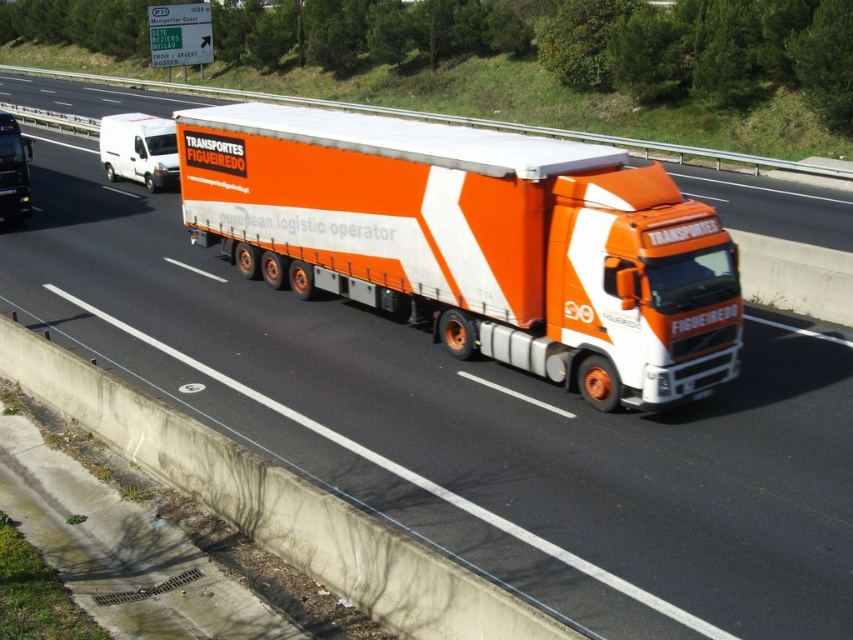
Which is above, white matte van at left or matte black truck at left?

white matte van at left

Which of these two, white matte van at left or matte black truck at left, stands taller?

Standing taller between the two is white matte van at left.

Image resolution: width=853 pixels, height=640 pixels. Find the location of `white matte van at left`. white matte van at left is located at coordinates (138, 148).

This screenshot has height=640, width=853. Identify the location of white matte van at left. (138, 148).

Between orange matte trailer truck at center and white matte van at left, which one has more height?

Standing taller between the two is white matte van at left.

Which is in front, point (540, 358) or point (160, 128)?

Point (540, 358)

I want to click on orange matte trailer truck at center, so click(476, 241).

Does orange matte trailer truck at center have a greater height compared to matte black truck at left?

No, orange matte trailer truck at center is not taller than matte black truck at left.

Between point (643, 177) and point (12, 116), which one is positioned behind?

The point (12, 116) is behind.

What are the coordinates of `orange matte trailer truck at center` in the screenshot? It's located at [x=476, y=241].